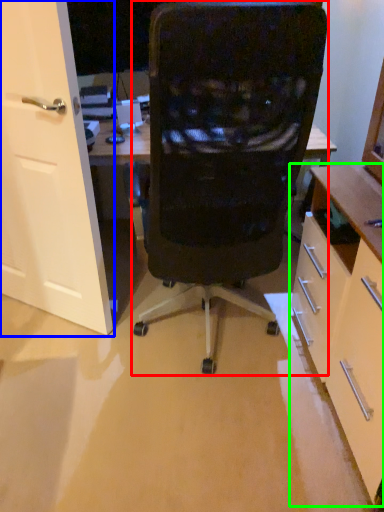
Question: Which object is the closest to the chair (highlighted by a red box)? Choose among these: door (highlighted by a blue box) or cabinetry (highlighted by a green box).

Choices:
 (A) door
 (B) cabinetry

Answer: (B)